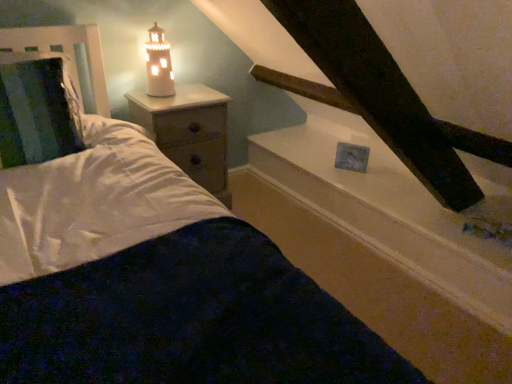
Question: Should I look upward or downward to see white soft bedding at center?

Choices:
 (A) up
 (B) down

Answer: (B)

Question: From the image's perspective, would you say white glossy window sill at upper center is positioned over white soft bedding at center?

Choices:
 (A) no
 (B) yes

Answer: (B)

Question: Does white glossy window sill at upper center lie in front of white soft bedding at center?

Choices:
 (A) yes
 (B) no

Answer: (B)

Question: From a real-world perspective, is white glossy window sill at upper center physically above white soft bedding at center?

Choices:
 (A) yes
 (B) no

Answer: (A)

Question: Does white glossy window sill at upper center have a smaller size compared to white soft bedding at center?

Choices:
 (A) yes
 (B) no

Answer: (B)

Question: Is white glossy window sill at upper center far from white soft bedding at center?

Choices:
 (A) no
 (B) yes

Answer: (B)

Question: Does white glossy window sill at upper center have a greater width compared to white soft bedding at center?

Choices:
 (A) yes
 (B) no

Answer: (B)

Question: From the image's perspective, does metallic silver headboard at left appear lower than white soft bedding at center?

Choices:
 (A) yes
 (B) no

Answer: (B)

Question: Is metallic silver headboard at left in front of white soft bedding at center?

Choices:
 (A) no
 (B) yes

Answer: (A)

Question: From the image's perspective, is metallic silver headboard at left on white soft bedding at center?

Choices:
 (A) yes
 (B) no

Answer: (A)

Question: Can you confirm if metallic silver headboard at left is smaller than white soft bedding at center?

Choices:
 (A) yes
 (B) no

Answer: (A)

Question: Considering the relative sizes of metallic silver headboard at left and white soft bedding at center in the image provided, is metallic silver headboard at left thinner than white soft bedding at center?

Choices:
 (A) no
 (B) yes

Answer: (B)

Question: Considering the relative sizes of metallic silver headboard at left and white soft bedding at center in the image provided, is metallic silver headboard at left shorter than white soft bedding at center?

Choices:
 (A) no
 (B) yes

Answer: (A)

Question: Is white soft bedding at center closer to camera compared to white glossy window sill at upper center?

Choices:
 (A) yes
 (B) no

Answer: (A)